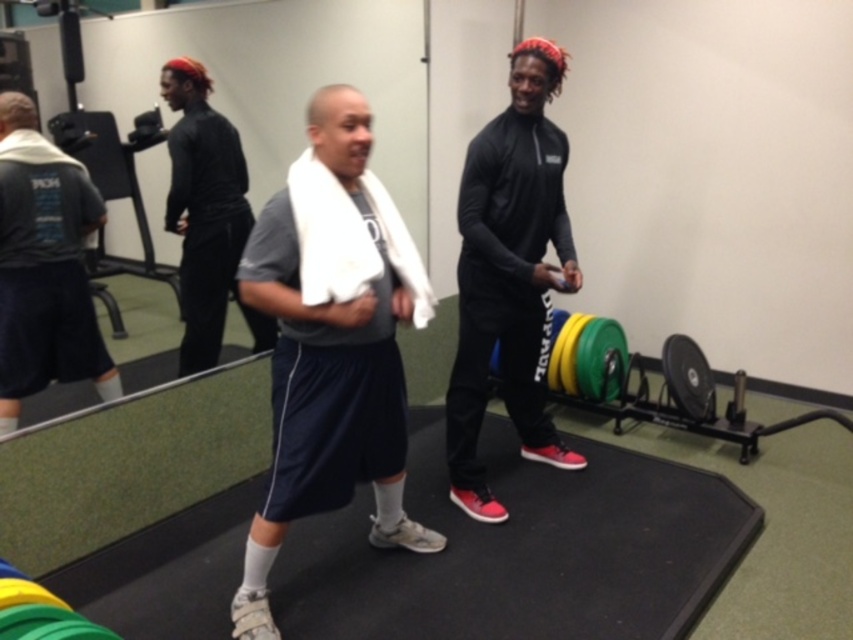
Question: Can you confirm if white fabric towel at center is wider than black matte shirt at center?

Choices:
 (A) yes
 (B) no

Answer: (A)

Question: Which object is closer to the camera taking this photo?

Choices:
 (A) white fabric towel at center
 (B) black matte shirt at center

Answer: (A)

Question: Is white fabric towel at center positioned before black matte shirt at center?

Choices:
 (A) yes
 (B) no

Answer: (A)

Question: Is black matte athletic wear at center to the right of gray cotton t-shirt at left from the viewer's perspective?

Choices:
 (A) yes
 (B) no

Answer: (A)

Question: Which of the following is the closest to the observer?

Choices:
 (A) gray cotton t-shirt at left
 (B) white fabric towel at center

Answer: (B)

Question: Which object is the farthest from the gray cotton t-shirt at left?

Choices:
 (A) black matte shirt at center
 (B) white fabric towel at center

Answer: (B)